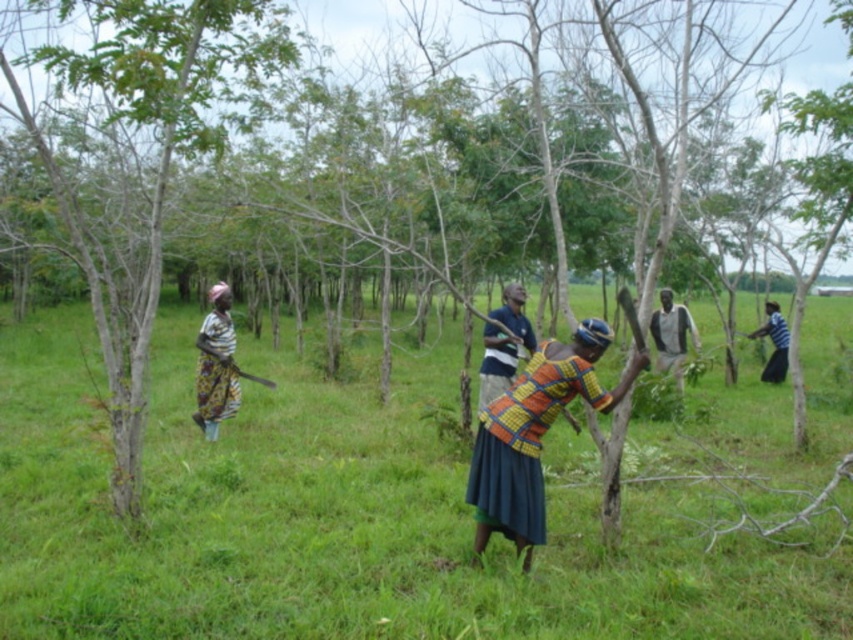
Question: Considering the real-world distances, which object is closest to the dark gray fabric shirt at center?

Choices:
 (A) multicolored woven cloth at center
 (B) green leafy tree at left
 (C) blue striped shirt at right
 (D) green grass at center

Answer: (C)

Question: Which point is closer to the camera?

Choices:
 (A) (28, 125)
 (B) (780, 380)
 (C) (583, 362)
 (D) (485, 328)

Answer: (A)

Question: Is green grass at center positioned before blue striped shirt at right?

Choices:
 (A) yes
 (B) no

Answer: (A)

Question: Is green grass at center bigger than green leafy tree at left?

Choices:
 (A) yes
 (B) no

Answer: (B)

Question: Does green leafy tree at left appear on the left side of multicolored woven cloth at center?

Choices:
 (A) yes
 (B) no

Answer: (A)

Question: Estimate the real-world distances between objects in this image. Which object is farther from the dark gray fabric shirt at center?

Choices:
 (A) green grass at center
 (B) multicolored woven cloth at center

Answer: (B)